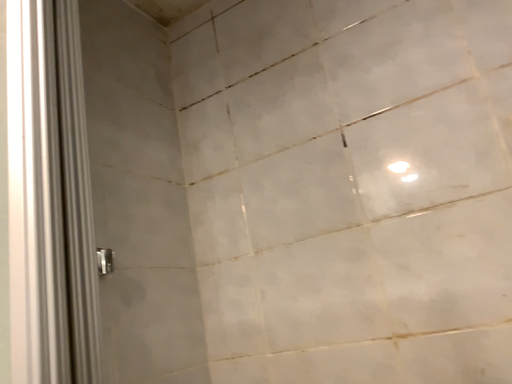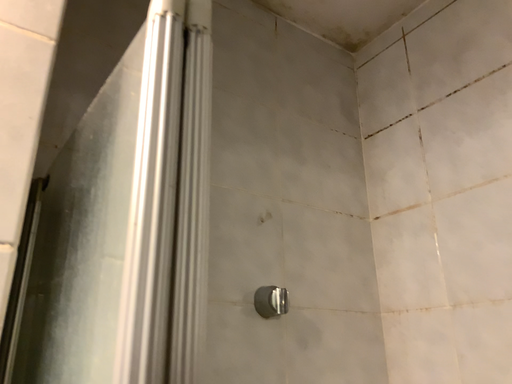
Question: How did the camera likely rotate when shooting the video?

Choices:
 (A) rotated right
 (B) rotated left

Answer: (B)